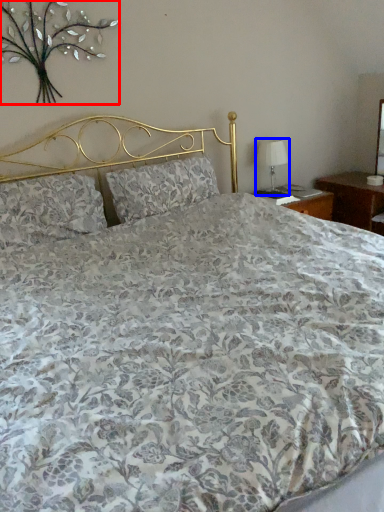
Question: Which object appears farthest to the camera in this image, floral arrangement (highlighted by a red box) or table lamp (highlighted by a blue box)?

Choices:
 (A) floral arrangement
 (B) table lamp

Answer: (B)